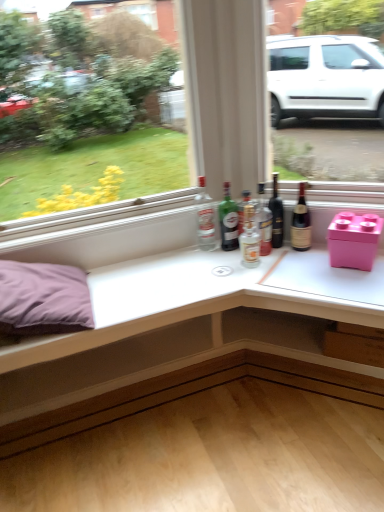
At what (x,y) coordinates should I click in order to perform the action: click on free space in front of green glass bottle at center, which ranks as the 4th bottle in right-to-left order. Please return your answer as a coordinate pair (x, y). This screenshot has width=384, height=512. Looking at the image, I should click on (229, 263).